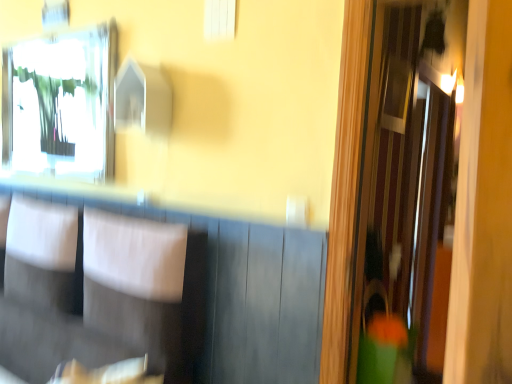
Question: Is clear glass mirror at upper left wider than white fabric armchair at center?

Choices:
 (A) yes
 (B) no

Answer: (B)

Question: Is clear glass mirror at upper left positioned beyond the bounds of white fabric armchair at center?

Choices:
 (A) no
 (B) yes

Answer: (B)

Question: Is clear glass mirror at upper left bigger than white fabric armchair at center?

Choices:
 (A) no
 (B) yes

Answer: (A)

Question: Can you confirm if clear glass mirror at upper left is shorter than white fabric armchair at center?

Choices:
 (A) yes
 (B) no

Answer: (B)

Question: From a real-world perspective, is clear glass mirror at upper left positioned under white fabric armchair at center based on gravity?

Choices:
 (A) yes
 (B) no

Answer: (B)

Question: Does clear glass mirror at upper left have a lesser width compared to white fabric armchair at center?

Choices:
 (A) no
 (B) yes

Answer: (B)

Question: Considering the relative sizes of white fabric armchair at center and clear glass mirror at upper left in the image provided, is white fabric armchair at center smaller than clear glass mirror at upper left?

Choices:
 (A) yes
 (B) no

Answer: (B)

Question: Is white fabric armchair at center located outside clear glass mirror at upper left?

Choices:
 (A) yes
 (B) no

Answer: (A)

Question: From a real-world perspective, does white fabric armchair at center sit lower than clear glass mirror at upper left?

Choices:
 (A) no
 (B) yes

Answer: (B)

Question: Does white fabric armchair at center have a larger size compared to clear glass mirror at upper left?

Choices:
 (A) no
 (B) yes

Answer: (B)

Question: Does white fabric armchair at center have a greater width compared to clear glass mirror at upper left?

Choices:
 (A) no
 (B) yes

Answer: (B)

Question: Is white fabric armchair at center at the right side of clear glass mirror at upper left?

Choices:
 (A) yes
 (B) no

Answer: (A)

Question: In terms of size, does clear glass mirror at upper left appear bigger or smaller than white fabric armchair at center?

Choices:
 (A) small
 (B) big

Answer: (A)